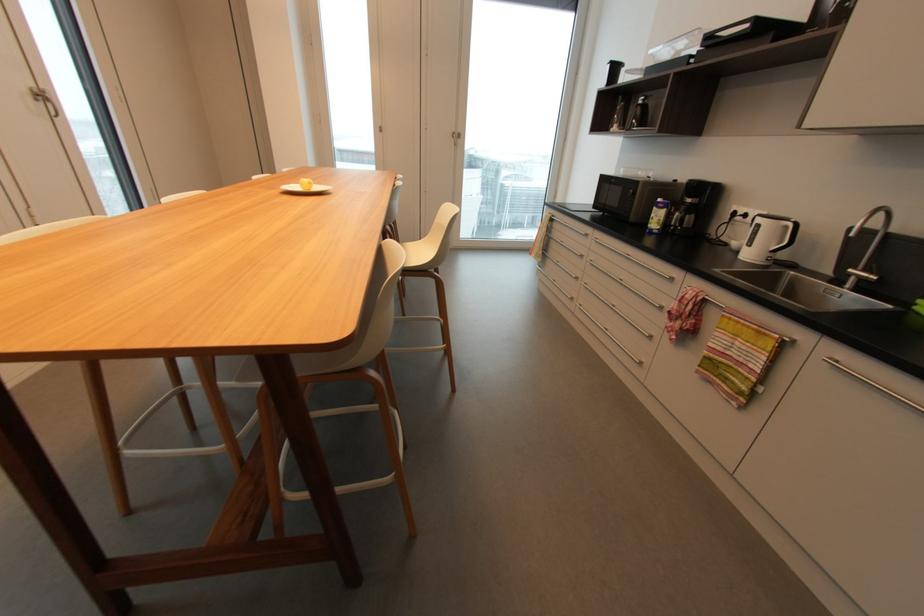
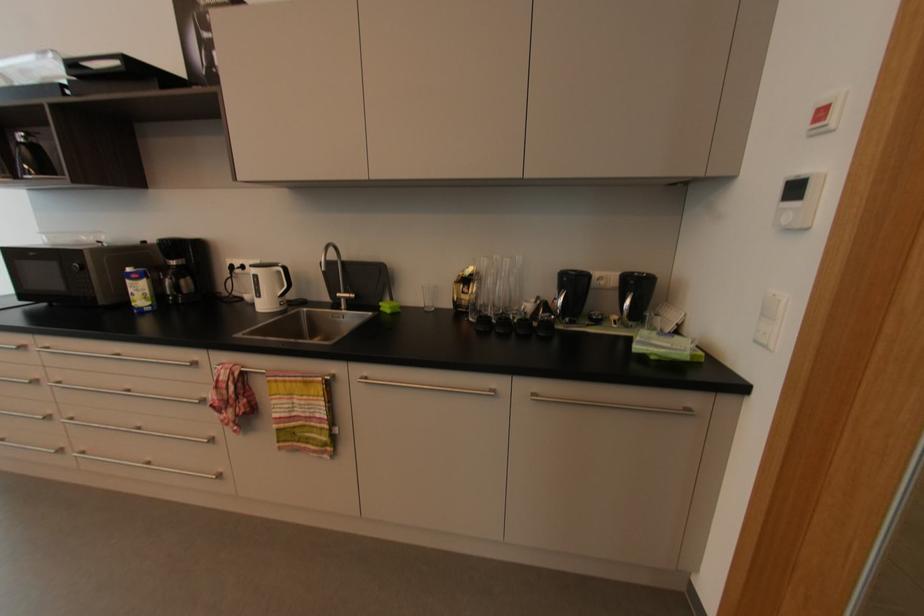
Locate, in the second image, the point that corresponds to the point at 789,227 in the first image.

(282, 273)